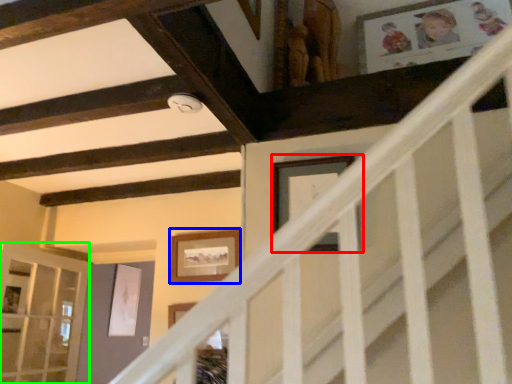
Question: Considering the real-world distances, which object is closest to picture frame (highlighted by a red box)? picture frame (highlighted by a blue box) or glass door (highlighted by a green box).

Choices:
 (A) picture frame
 (B) glass door

Answer: (A)